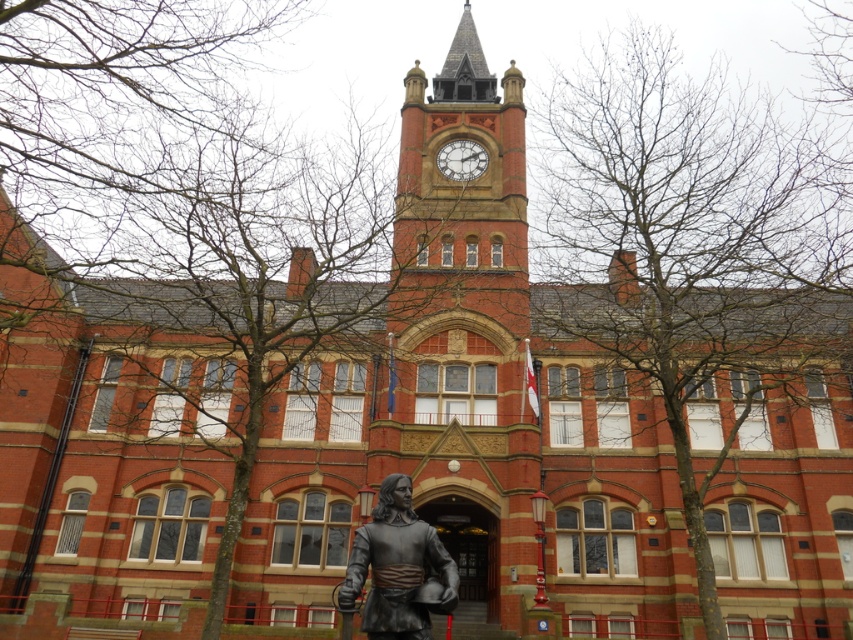
You are standing in front of the historic building and want to take a photo of both the bare branches at center and the white painted metal clock at upper center. To include both in the frame, should you adjust your camera to the left or right?

You should adjust your camera to the left because the bare branches at center is to the left of the white painted metal clock at upper center, so moving left will ensure both are in the frame.

You are an architect examining the building and notice the bare branches at center and the white painted metal clock at upper center. Which object occupies more space in the scene?

The bare branches at center has a larger size compared to the white painted metal clock at upper center, so it occupies more space in the scene.

Looking at this image, you are a maintenance worker needing to move a 150 feet long extension ladder from the bare branches at left to the bronze statue at center. Can you move it without tilting it vertically?

The distance between the bare branches at left and bronze statue at center is 153.79 feet. Since the ladder is 150 feet long, it can be moved horizontally as the distance between them is greater than the ladder length.